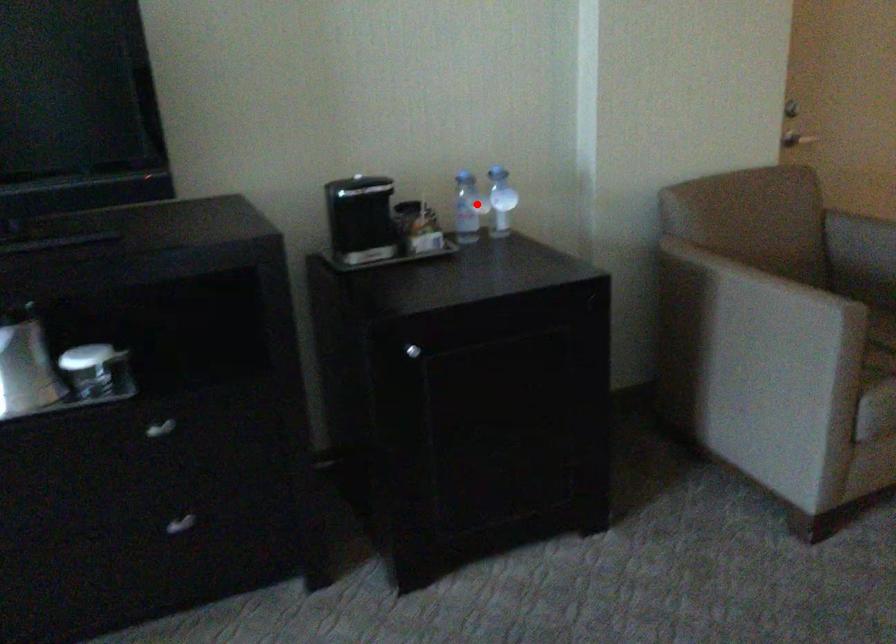
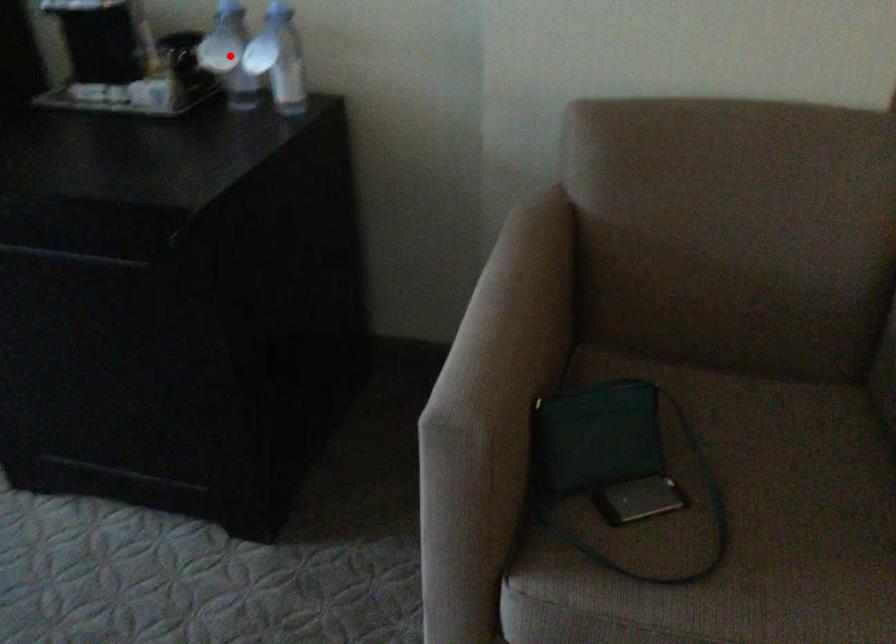
I am providing you with two images of the same scene from different viewpoints. A red point is marked on the first image and another point is marked on the second image. Are the points marked in image1 and image2 representing the same 3D position?

Yes